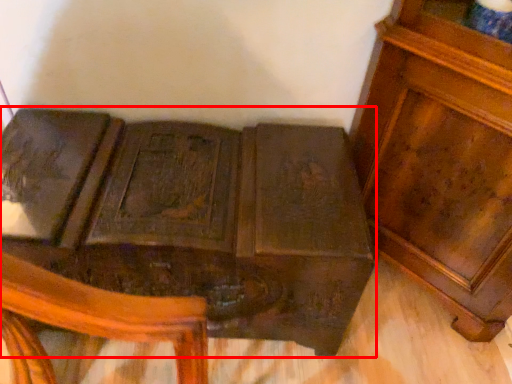
Question: Observing the image, what is the correct spatial positioning of furniture (annotated by the red box) in reference to furniture?

Choices:
 (A) right
 (B) left

Answer: (B)